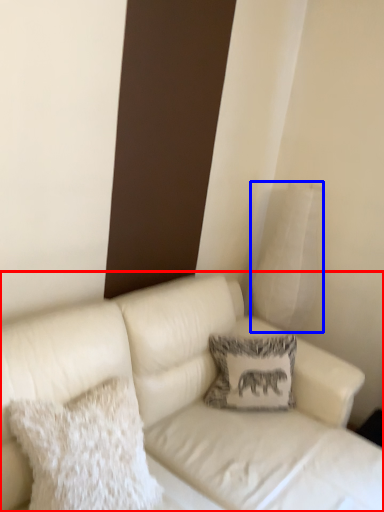
Question: Among these objects, which one is nearest to the camera, studio couch (highlighted by a red box) or pillow (highlighted by a blue box)?

Choices:
 (A) studio couch
 (B) pillow

Answer: (A)